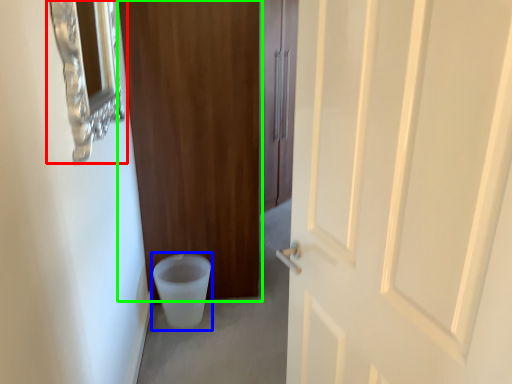
Question: Which object is positioned farthest from medicine cabinet (highlighted by a red box)? Select from toilet bowl (highlighted by a blue box) and door (highlighted by a green box).

Choices:
 (A) toilet bowl
 (B) door

Answer: (A)